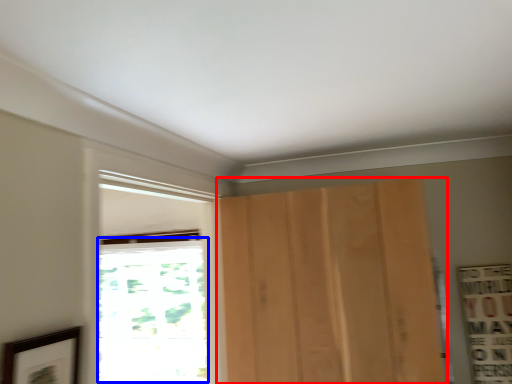
Question: Which object appears farthest to the camera in this image, door (highlighted by a red box) or window (highlighted by a blue box)?

Choices:
 (A) door
 (B) window

Answer: (B)